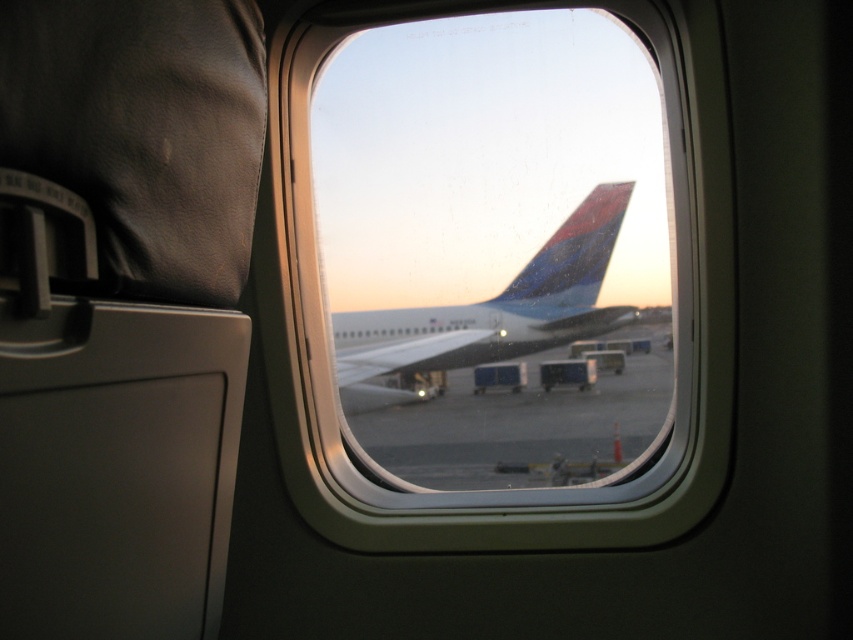
You are a flight attendant checking the exterior of the airplane. You need to locate the Southwest Airlines aircraft parked on the tarmac. Where should you look relative to the transparent glass airplane window at center?

The transparent glass airplane window at center is located at point (494, 252), so you should look towards that coordinate to locate the Southwest Airlines aircraft parked on the tarmac.

You are a flight attendant checking the exterior of the plane. You notice the transparent glass airplane window at center and the smooth concrete tarmac at center. Which object is bigger in size?

The transparent glass airplane window at center has a larger size compared to the smooth concrete tarmac at center.

You are a flight attendant checking the exterior of the airplane. You see the transparent glass airplane window at center and the metallic blue airplane at center. Which object is higher in the image?

The transparent glass airplane window at center is higher than the metallic blue airplane at center.